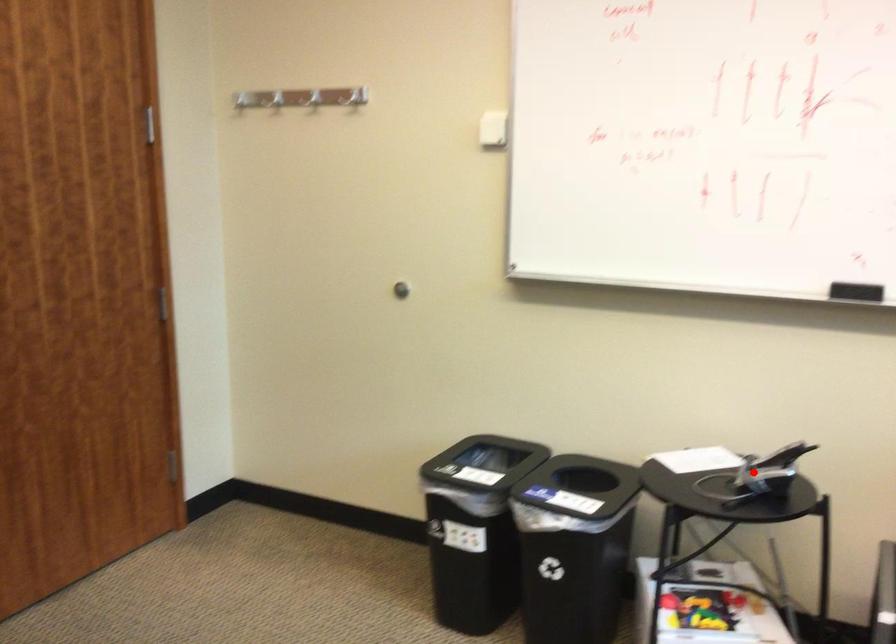
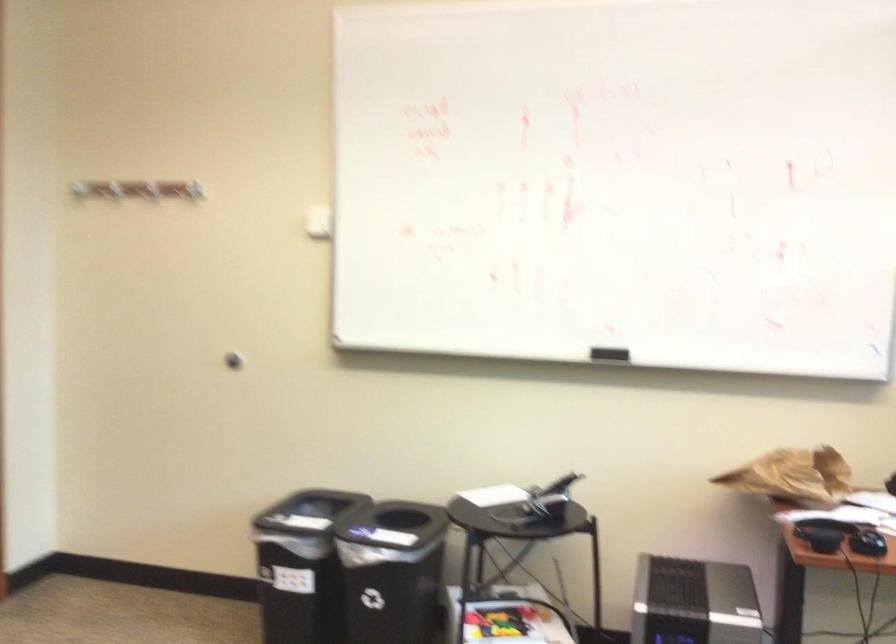
Question: I am providing you with two images of the same scene from different viewpoints. Given a red point in image1, look at the same physical point in image2. Is it:

Choices:
 (A) Closer to the viewpoint
 (B) Farther from the viewpoint

Answer: (B)